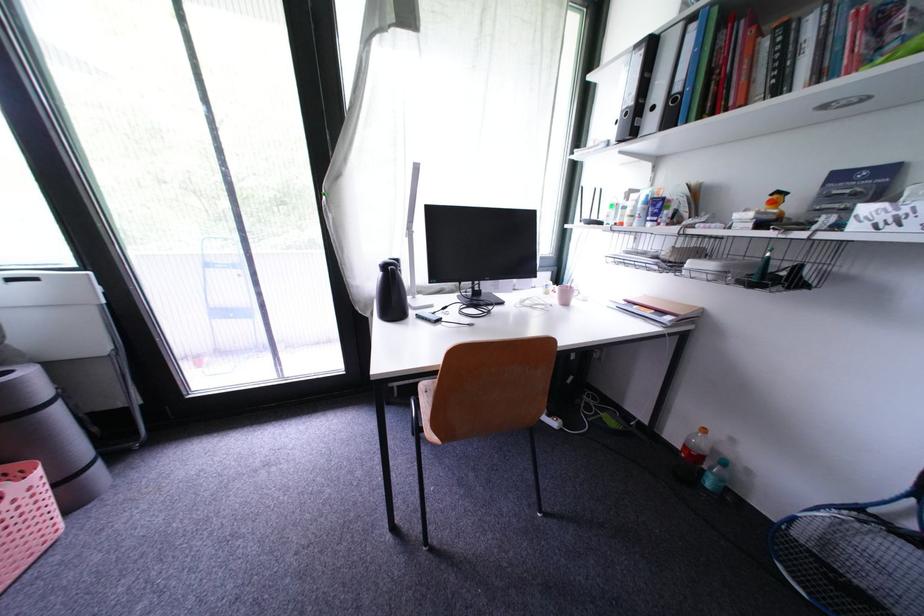
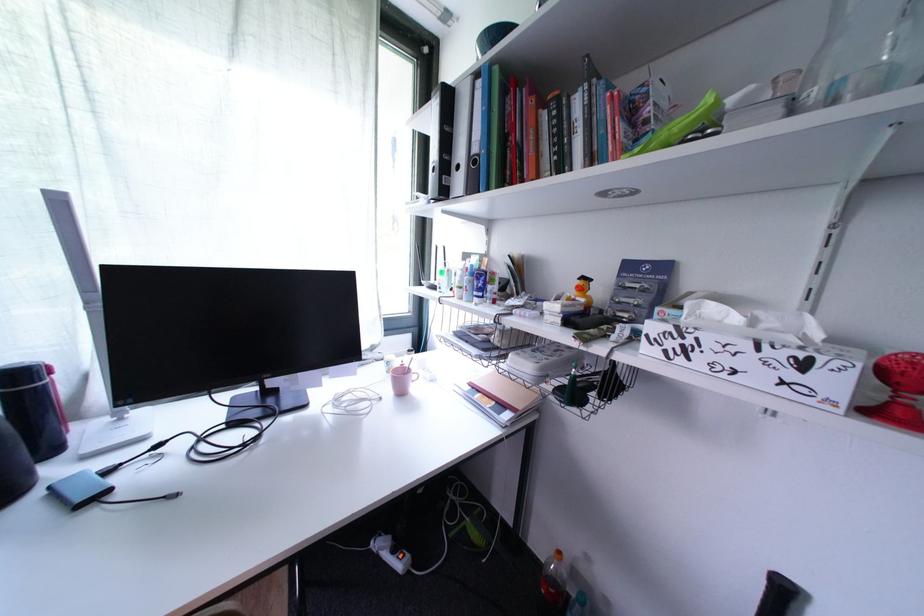
Where in the second image is the point corresponding to point 556,418 from the first image?

(402, 553)